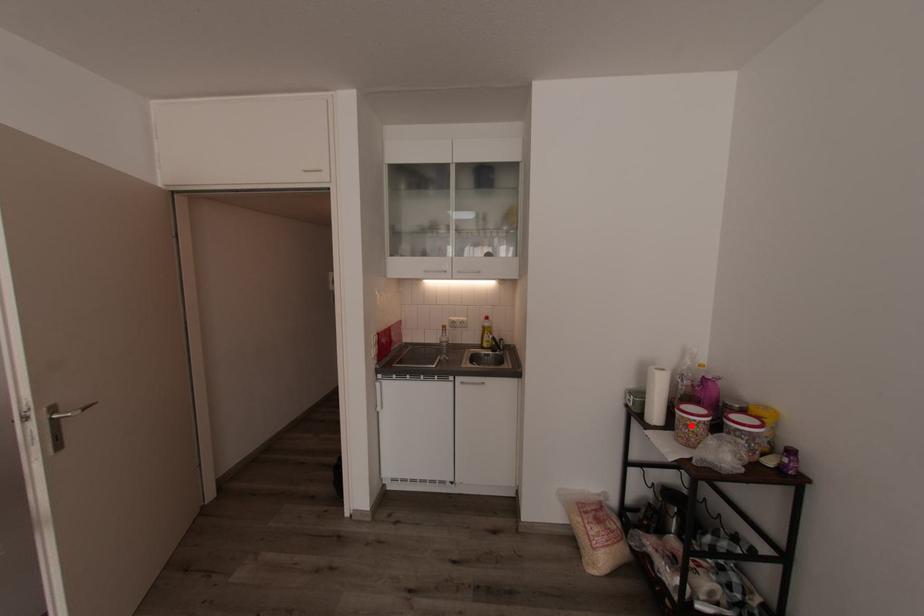
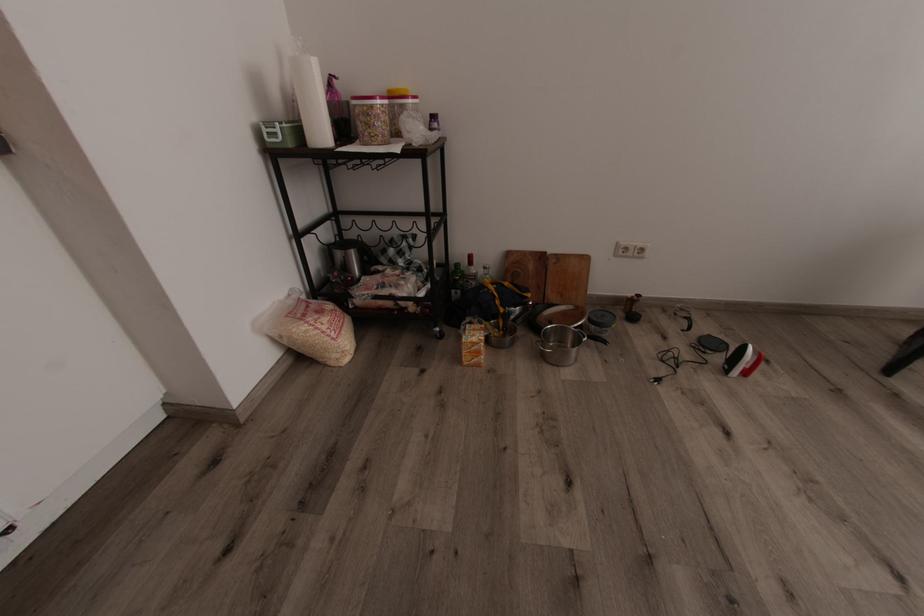
Question: I am providing you with two images of the same scene from different viewpoints. A red point is marked on the first image. Can you still see the location of the red point in image 2?

Choices:
 (A) Yes
 (B) No

Answer: (A)